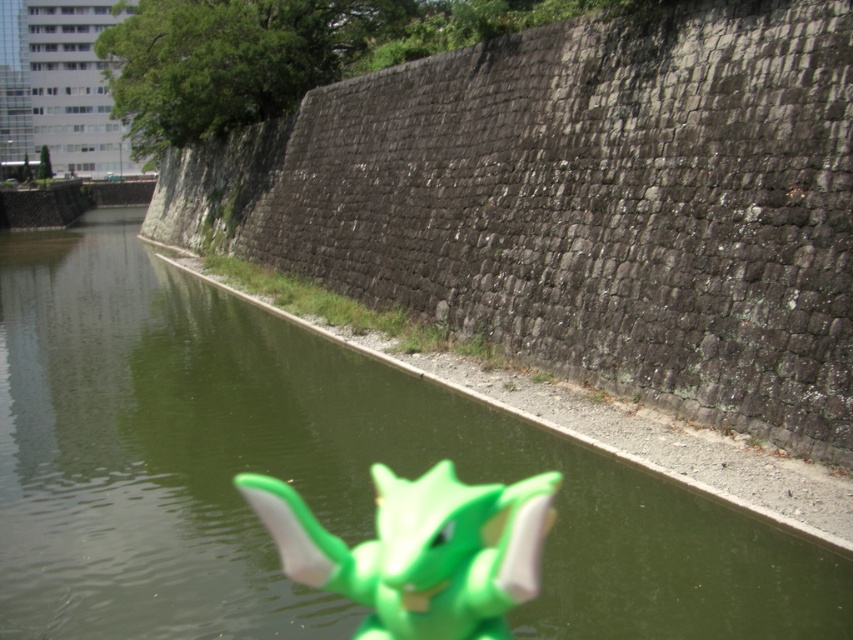
You are standing at the edge of the canal and see the green plastic river at center and the green matte toy at center. Which object is wider in this scene?

The green plastic river at center is wider than the green matte toy at center according to the description.

You are standing at the edge of the canal and want to place a small flag at the point closer to you between point (x=184, y=384) and point (x=422, y=492). Which point should you choose?

You should choose point (x=184, y=384) because it is closer to you than point (x=422, y=492).